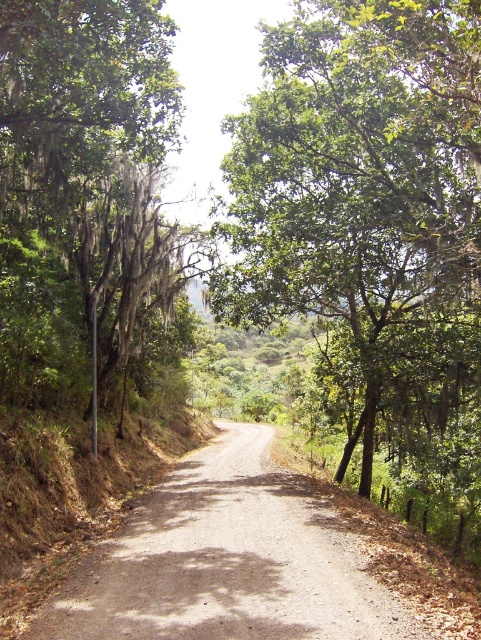
Question: Is green mossy tree at left closer to camera compared to dirt/gravel road at center?

Choices:
 (A) yes
 (B) no

Answer: (B)

Question: Which point is closer to the camera taking this photo?

Choices:
 (A) (314, 253)
 (B) (125, 125)

Answer: (B)

Question: Which point is closer to the camera?

Choices:
 (A) dirt/gravel road at center
 (B) green leafy tree at center

Answer: (A)

Question: Is green mossy tree at left positioned behind dirt/gravel road at center?

Choices:
 (A) no
 (B) yes

Answer: (B)

Question: Does green leafy tree at center have a lesser width compared to dirt/gravel road at center?

Choices:
 (A) yes
 (B) no

Answer: (B)

Question: Estimate the real-world distances between objects in this image. Which object is closer to the dirt/gravel road at center?

Choices:
 (A) green leafy tree at center
 (B) green mossy tree at left

Answer: (B)